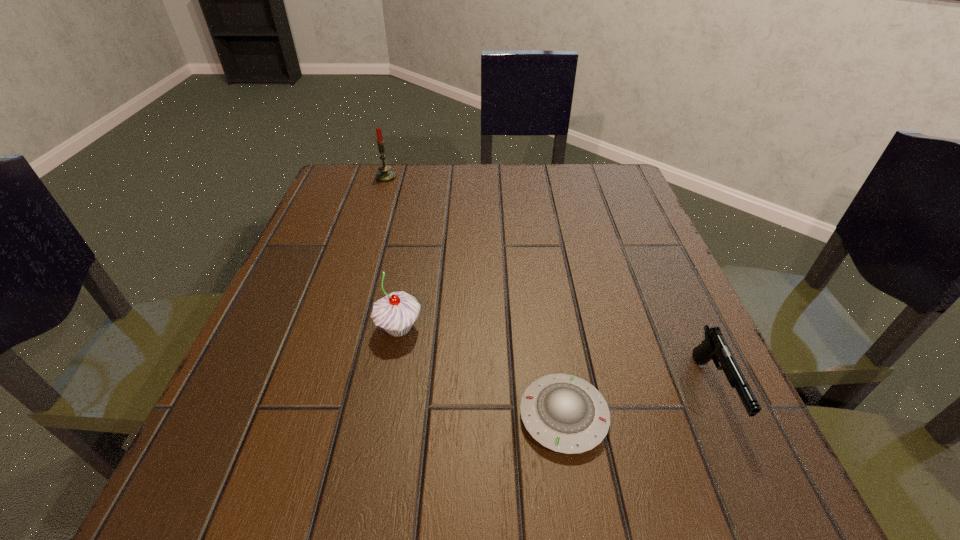
Find the location of a particular element. free area in between the second object from left to right and the gun is located at coordinates (556, 360).

Where is `free spot between the second object from right to left and the farthest object`? free spot between the second object from right to left and the farthest object is located at coordinates (x=474, y=297).

Image resolution: width=960 pixels, height=540 pixels. In order to click on vacant area that lies between the cupcake and the rightmost object in this screenshot , I will do `click(556, 360)`.

Choose which object is the nearest neighbor to the candle. Please provide its 2D coordinates. Your answer should be formatted as a tuple, i.e. [(x, y)], where the tuple contains the x and y coordinates of a point satisfying the conditions above.

[(395, 313)]

Select which object appears as the second closest to the third object from right to left. Please provide its 2D coordinates. Your answer should be formatted as a tuple, i.e. [(x, y)], where the tuple contains the x and y coordinates of a point satisfying the conditions above.

[(714, 347)]

Locate an element on the screen. vacant space that satisfies the following two spatial constraints: 1. on the front side of the third object from left to right; 2. on the left side of the leftmost object is located at coordinates (310, 416).